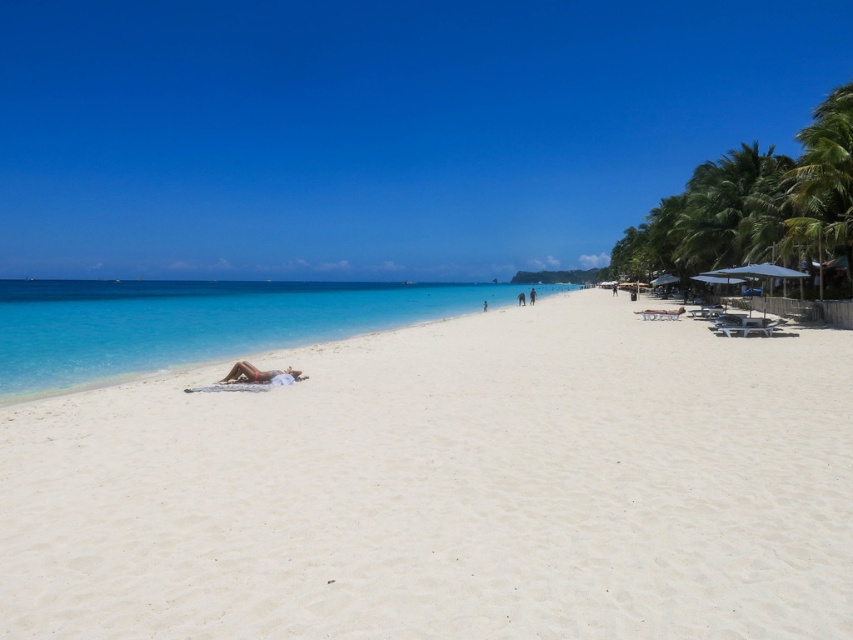
Question: Does white sandy beach at center appear under tan skin person at center?

Choices:
 (A) yes
 (B) no

Answer: (B)

Question: Among these points, which one is nearest to the camera?

Choices:
 (A) (256, 372)
 (B) (424, 582)
 (C) (784, 179)

Answer: (B)

Question: Can you confirm if white sandy beach at center is positioned to the left of green leafy palm tree at upper right?

Choices:
 (A) yes
 (B) no

Answer: (A)

Question: Which object is farther from the camera taking this photo?

Choices:
 (A) green leafy palm tree at upper right
 (B) white sandy beach at center
 (C) clear blue water at center
 (D) tan skin person at center

Answer: (A)

Question: Does white sandy beach at center have a larger size compared to clear blue water at center?

Choices:
 (A) no
 (B) yes

Answer: (A)

Question: Based on their relative distances, which object is nearer to the green leafy palm tree at upper right?

Choices:
 (A) tan skin person at center
 (B) clear blue water at center
 (C) white sandy beach at center

Answer: (C)